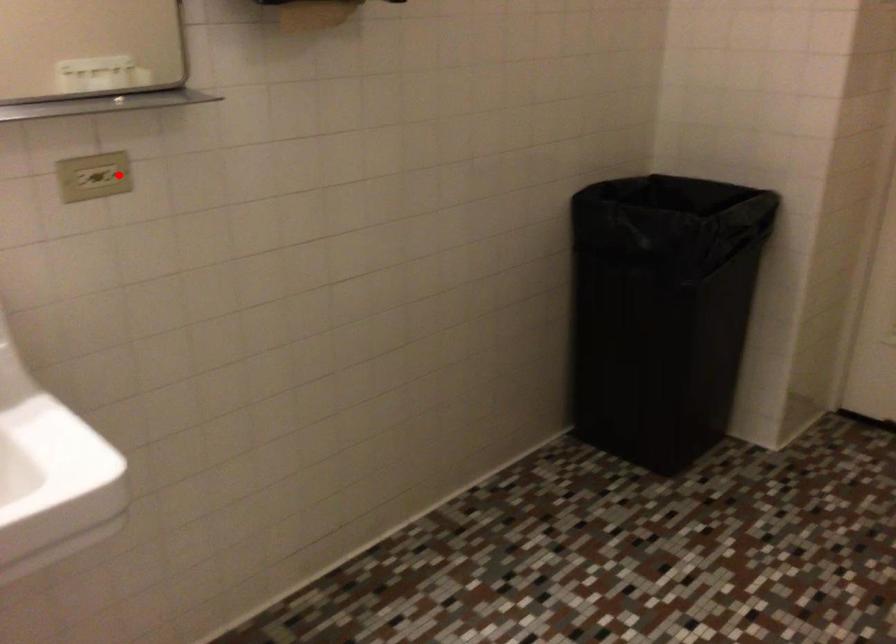
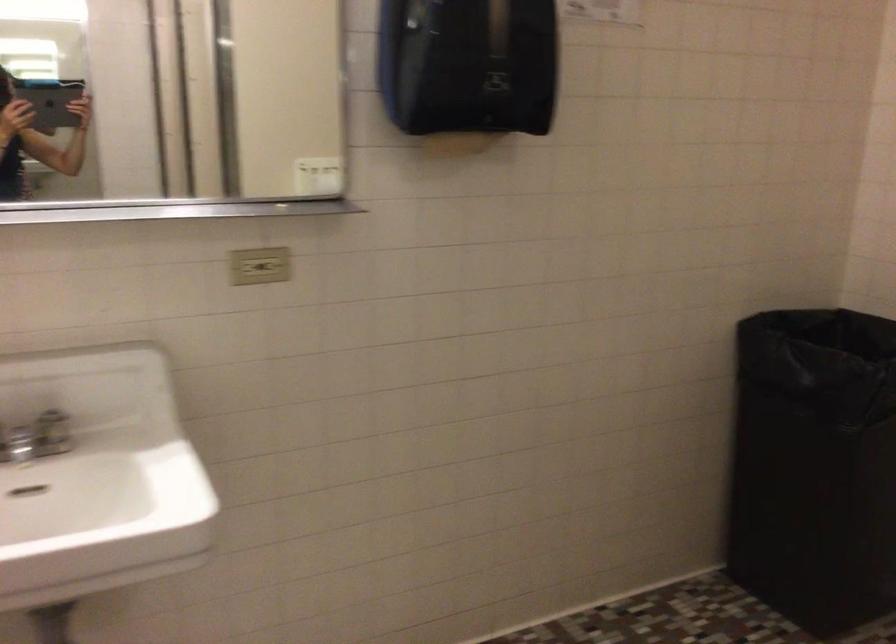
The point at the highlighted location is marked in the first image. Where is the corresponding point in the second image?

(273, 266)